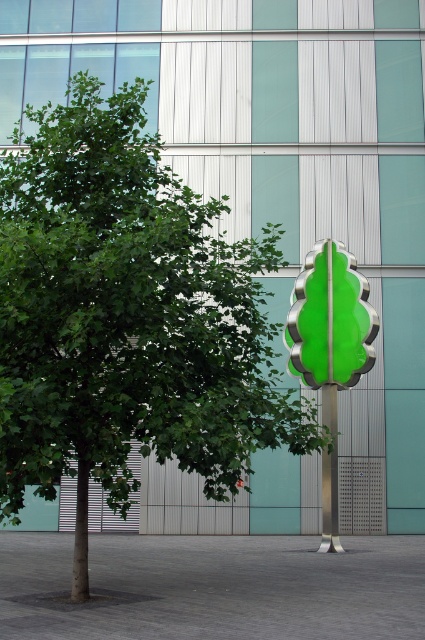
Question: Can you confirm if green leafy tree at center is wider than green glass traffic light at center?

Choices:
 (A) yes
 (B) no

Answer: (B)

Question: Which of the following is the farthest from the observer?

Choices:
 (A) (336, 540)
 (B) (328, 371)

Answer: (B)

Question: Which object is farther from the camera taking this photo?

Choices:
 (A) metallic pole at center
 (B) green glass traffic light at center

Answer: (A)

Question: Can you confirm if green leafy tree at center is smaller than metallic pole at center?

Choices:
 (A) no
 (B) yes

Answer: (A)

Question: Estimate the real-world distances between objects in this image. Which object is farther from the green leafy tree at center?

Choices:
 (A) green glass traffic light at center
 (B) metallic pole at center

Answer: (B)

Question: Does green leafy tree at center appear under green glass traffic light at center?

Choices:
 (A) no
 (B) yes

Answer: (A)